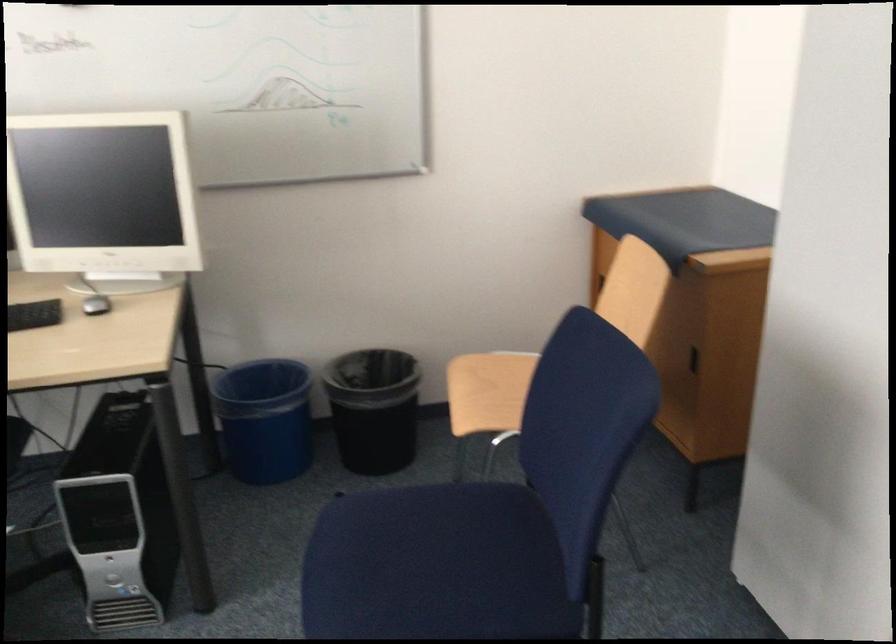
Question: How did the camera likely rotate?

Choices:
 (A) Left
 (B) Right
 (C) Up
 (D) Down

Answer: (B)